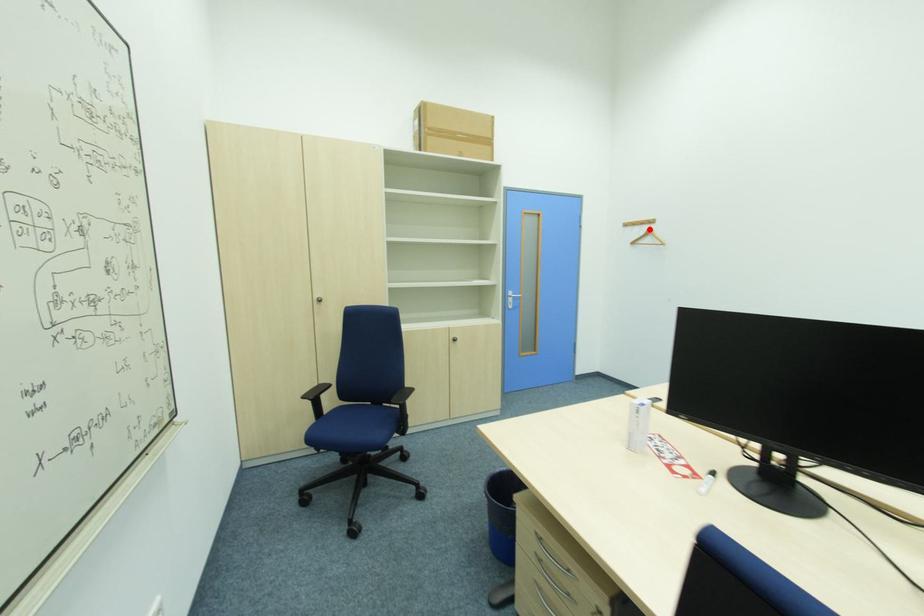
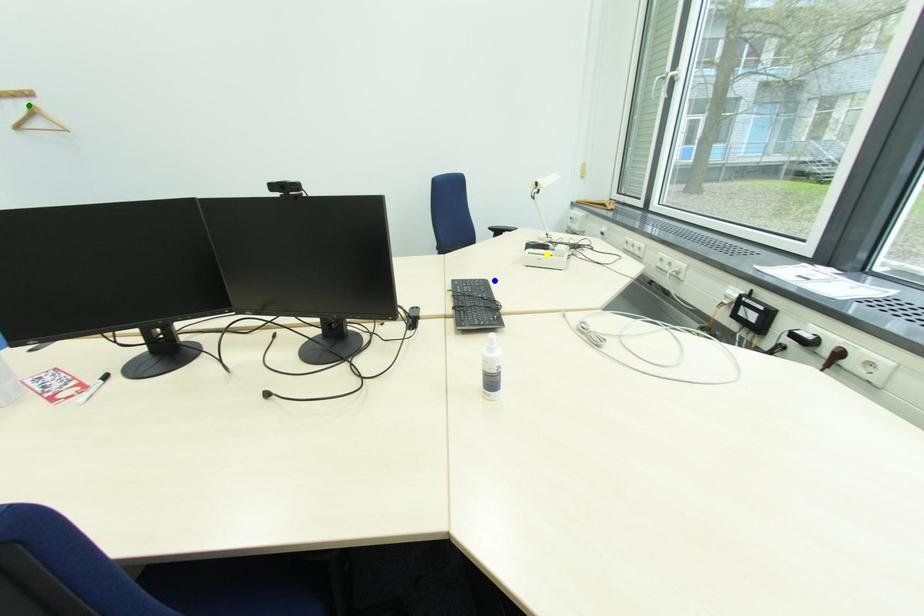
Question: I am providing you with two images of the same scene from different viewpoints. A red point is marked on the first image. You are given multiple points on the second image. In image 2, which mark is for the same physical point as the one in image 1?

Choices:
 (A) blue point
 (B) yellow point
 (C) green point

Answer: (C)